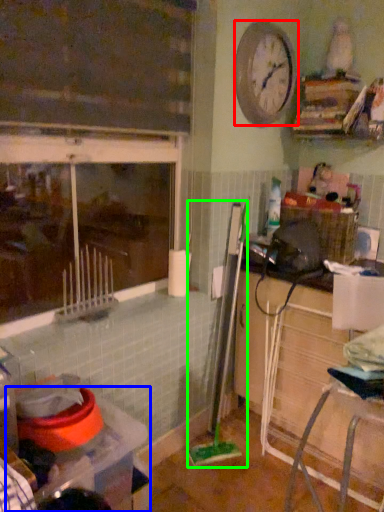
Question: Estimate the real-world distances between objects in this image. Which object is closer to clock (highlighted by a red box), table (highlighted by a blue box) or brush (highlighted by a green box)?

Choices:
 (A) table
 (B) brush

Answer: (A)